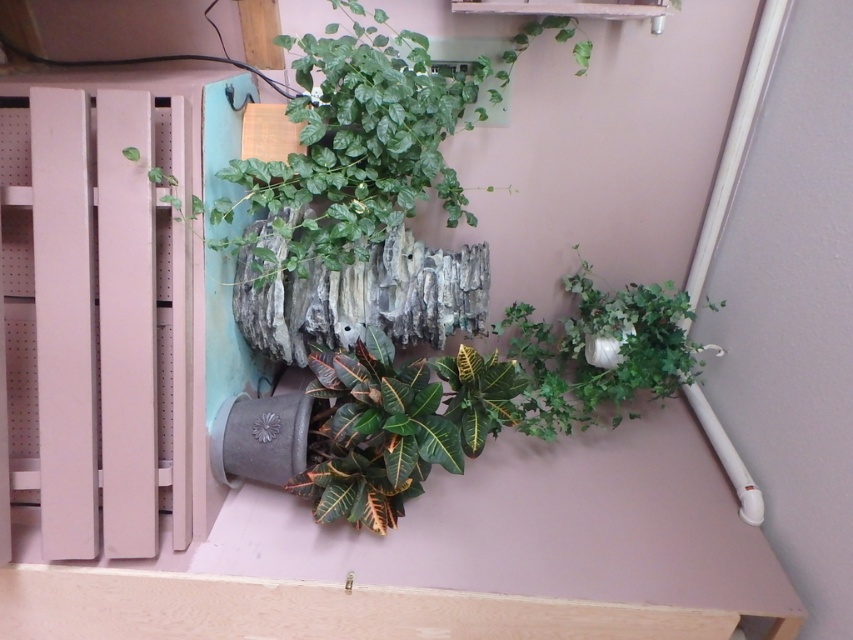
Question: Can you confirm if green leafy plant at upper center is wider than green glossy leafy plant at center?

Choices:
 (A) no
 (B) yes

Answer: (B)

Question: Can you confirm if green matte plant at right is positioned above green matte plant at center?

Choices:
 (A) yes
 (B) no

Answer: (A)

Question: Which object is positioned farthest from the green matte plant at center?

Choices:
 (A) green matte plant at right
 (B) green leafy plant at upper center
 (C) green glossy leafy plant at center

Answer: (A)

Question: Which object appears farthest from the camera in this image?

Choices:
 (A) green leafy plant at upper center
 (B) green matte plant at center
 (C) green glossy leafy plant at center

Answer: (C)

Question: Does green matte plant at center appear over green glossy leafy plant at center?

Choices:
 (A) no
 (B) yes

Answer: (A)

Question: Which of the following is the farthest from the observer?

Choices:
 (A) (473, 371)
 (B) (560, 385)
 (C) (404, 83)
 (D) (398, 419)

Answer: (B)